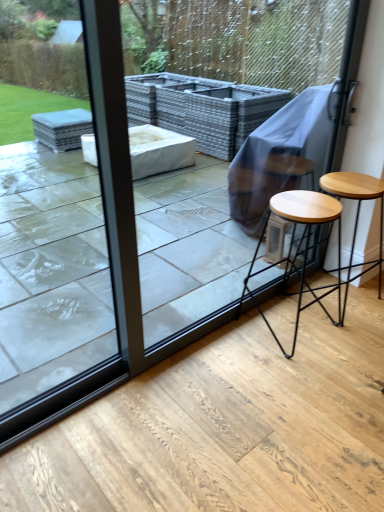
Question: Is light brown wood stool at lower right, the 1th stool when ordered from left to right, positioned with its back to light brown wood stool at right, the 2th stool positioned from the left?

Choices:
 (A) yes
 (B) no

Answer: (B)

Question: Can you confirm if light brown wood stool at lower right, the 2th stool from the right, is shorter than light brown wood stool at right, marked as the 1th stool in a right-to-left arrangement?

Choices:
 (A) yes
 (B) no

Answer: (B)

Question: Is light brown wood stool at lower right, the 1th stool when ordered from left to right, in front of light brown wood stool at right, marked as the 1th stool in a right-to-left arrangement?

Choices:
 (A) yes
 (B) no

Answer: (A)

Question: Could you tell me if light brown wood stool at lower right, the 1th stool when ordered from left to right, is facing light brown wood stool at right, the 2th stool positioned from the left?

Choices:
 (A) yes
 (B) no

Answer: (B)

Question: Is light brown wood stool at lower right, the 2th stool from the right, thinner than light brown wood stool at right, marked as the 1th stool in a right-to-left arrangement?

Choices:
 (A) no
 (B) yes

Answer: (B)

Question: Does light brown wood stool at lower right, the 2th stool from the right, have a larger size compared to light brown wood stool at right, the 2th stool positioned from the left?

Choices:
 (A) no
 (B) yes

Answer: (B)

Question: Can you confirm if transparent glass screen door at upper center is positioned to the right of light brown wood stool at lower right, the 1th stool when ordered from left to right?

Choices:
 (A) no
 (B) yes

Answer: (A)

Question: Is transparent glass screen door at upper center surrounding light brown wood stool at lower right, the 1th stool when ordered from left to right?

Choices:
 (A) no
 (B) yes

Answer: (A)

Question: Is transparent glass screen door at upper center turned away from light brown wood stool at lower right, the 1th stool when ordered from left to right?

Choices:
 (A) yes
 (B) no

Answer: (A)

Question: Considering the relative positions of transparent glass screen door at upper center and light brown wood stool at lower right, the 2th stool from the right, in the image provided, is transparent glass screen door at upper center to the left of light brown wood stool at lower right, the 2th stool from the right, from the viewer's perspective?

Choices:
 (A) yes
 (B) no

Answer: (A)

Question: Does transparent glass screen door at upper center lie behind light brown wood stool at lower right, the 1th stool when ordered from left to right?

Choices:
 (A) yes
 (B) no

Answer: (B)

Question: From the image's perspective, is transparent glass screen door at upper center above light brown wood stool at lower right, the 1th stool when ordered from left to right?

Choices:
 (A) no
 (B) yes

Answer: (B)

Question: Can you confirm if transparent glass door at upper left is smaller than light brown wood stool at right, the 2th stool positioned from the left?

Choices:
 (A) no
 (B) yes

Answer: (B)